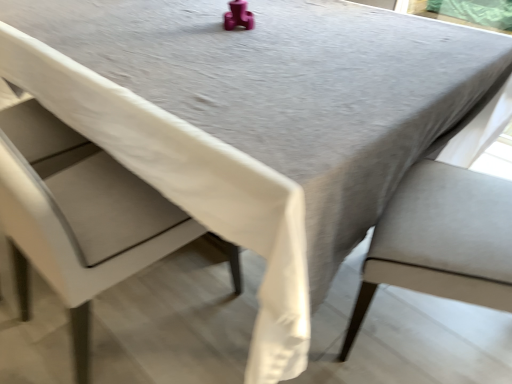
Question: In the image, is satin beige chair at right, which appears as the second chair when viewed from the left, positioned in front of or behind white fabric chair at left, which is the second chair from right to left?

Choices:
 (A) front
 (B) behind

Answer: (B)

Question: Would you say satin beige chair at right, marked as the 1th chair in a right-to-left arrangement, is inside or outside white fabric chair at left, which is the second chair from right to left?

Choices:
 (A) outside
 (B) inside

Answer: (A)

Question: Is satin beige chair at right, marked as the 1th chair in a right-to-left arrangement, bigger or smaller than white fabric chair at left, which is the second chair from right to left?

Choices:
 (A) small
 (B) big

Answer: (A)

Question: Considering their positions, is white fabric chair at left, which is the second chair from right to left, located in front of or behind satin beige chair at right, which appears as the second chair when viewed from the left?

Choices:
 (A) behind
 (B) front

Answer: (B)

Question: In terms of width, does white fabric chair at left, which is counted as the first chair, starting from the left, look wider or thinner when compared to satin beige chair at right, marked as the 1th chair in a right-to-left arrangement?

Choices:
 (A) wide
 (B) thin

Answer: (A)

Question: Would you say white fabric chair at left, which is counted as the first chair, starting from the left, is to the left or to the right of satin beige chair at right, which appears as the second chair when viewed from the left, in the picture?

Choices:
 (A) right
 (B) left

Answer: (B)

Question: Does point (91, 238) appear closer or farther from the camera than point (455, 243)?

Choices:
 (A) farther
 (B) closer

Answer: (A)